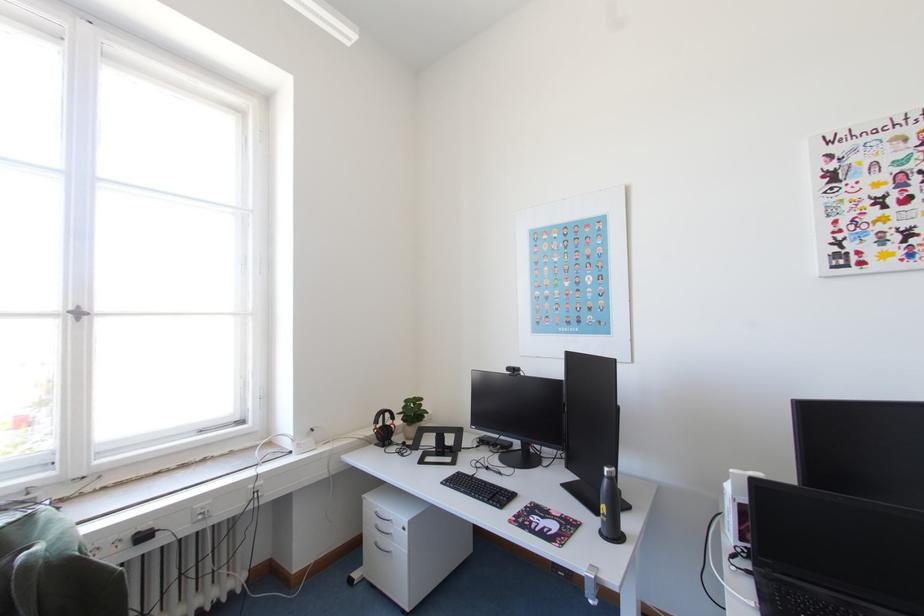
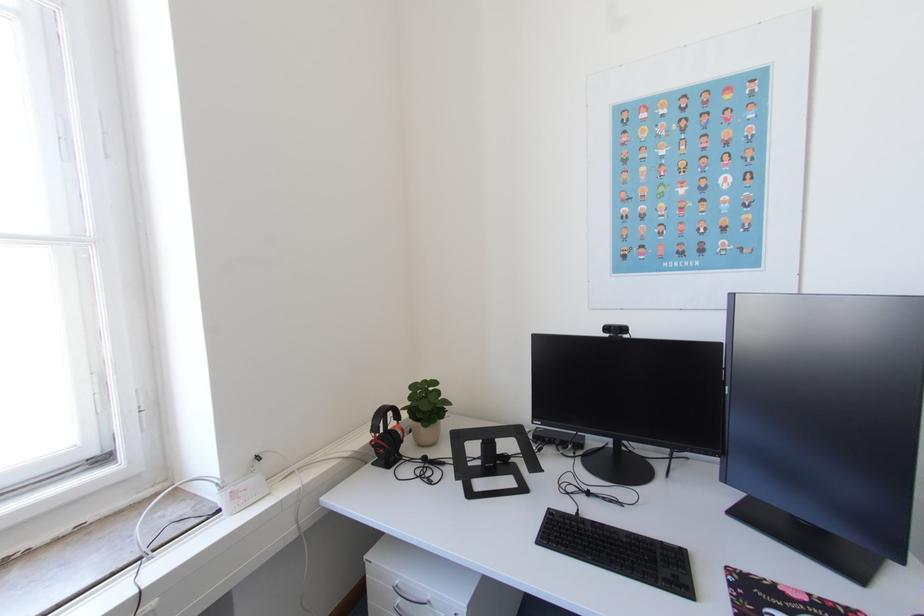
Which direction would the cameraman need to move to produce the second image?

The cameraman moved toward left, forward.